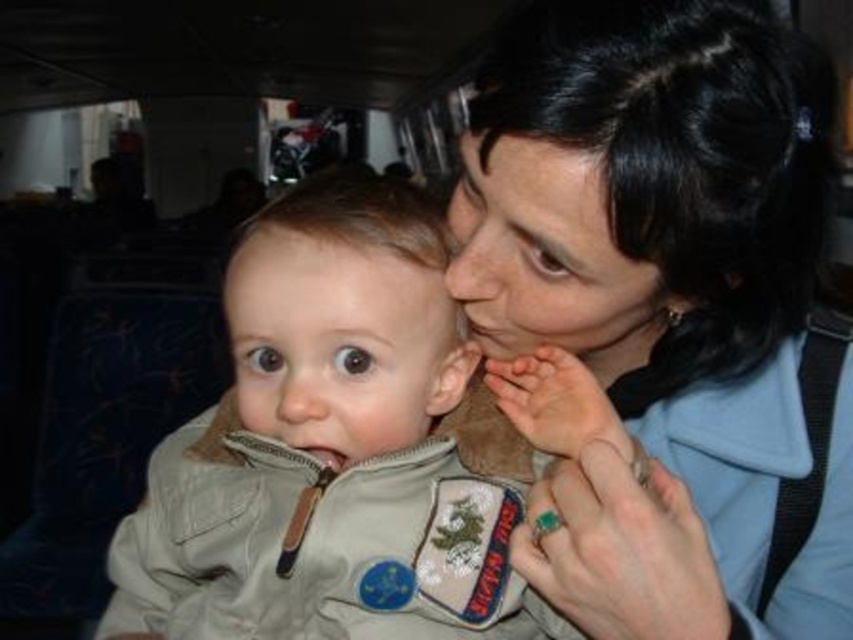
Is smooth beige baby at center further to the viewer compared to smooth skin face at center?

Yes.

Which is behind, point (267, 365) or point (511, 166)?

The point (267, 365) is behind.

Image resolution: width=853 pixels, height=640 pixels. I want to click on smooth beige baby at center, so (x=338, y=344).

Between point (453, 288) and point (267, 301), which one is positioned behind?

The point (453, 288) is more distant.

Is point (486, 253) positioned after point (318, 298)?

That is True.

Where is `matte khaki jacket at center`? Image resolution: width=853 pixels, height=640 pixels. matte khaki jacket at center is located at coordinates pyautogui.click(x=663, y=310).

What are the coordinates of `matte khaki jacket at center` in the screenshot? It's located at (663, 310).

Does smooth beige baby at center have a larger size compared to light brown matte forehead at center?

Correct, smooth beige baby at center is larger in size than light brown matte forehead at center.

Measure the distance between smooth beige baby at center and camera.

The distance of smooth beige baby at center from camera is 21.18 inches.

Where is `smooth beige baby at center`? This screenshot has width=853, height=640. smooth beige baby at center is located at coordinates (338, 344).